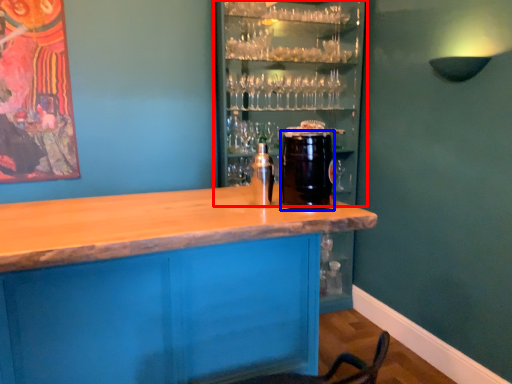
Question: Which of the following is the closest to the observer, shelf (highlighted by a red box) or beverage (highlighted by a blue box)?

Choices:
 (A) shelf
 (B) beverage

Answer: (B)